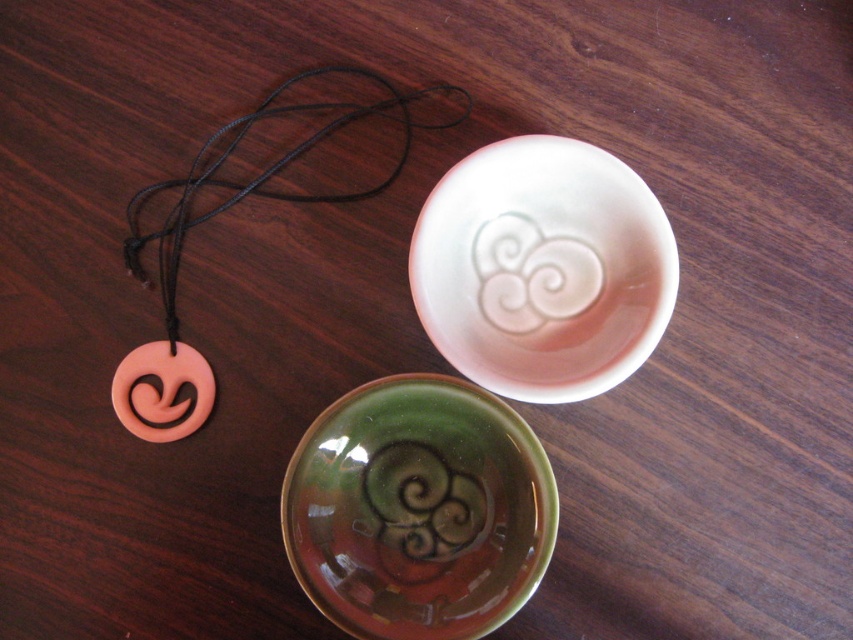
Which of these two, white glossy bowl at upper center or pink matte/porcelain pendant at left, stands taller?

white glossy bowl at upper center

Does white glossy bowl at upper center have a greater width compared to pink matte/porcelain pendant at left?

Indeed, white glossy bowl at upper center has a greater width compared to pink matte/porcelain pendant at left.

Find the location of a particular element. white glossy bowl at upper center is located at coordinates (543, 268).

Looking at this image, does white glossy bowl at upper center appear on the left side of white glossy swirl at upper center?

No, white glossy bowl at upper center is not to the left of white glossy swirl at upper center.

Image resolution: width=853 pixels, height=640 pixels. In order to click on white glossy bowl at upper center in this screenshot , I will do `click(543, 268)`.

Is green glossy bowl at center to the left of white glossy bowl at upper center from the viewer's perspective?

Yes, green glossy bowl at center is to the left of white glossy bowl at upper center.

Between green glossy bowl at center and white glossy bowl at upper center, which one is positioned lower?

Positioned lower is green glossy bowl at center.

Between point (395, 614) and point (498, 173), which one is positioned behind?

Point (498, 173)

Where is `green glossy bowl at center`? This screenshot has height=640, width=853. green glossy bowl at center is located at coordinates (418, 509).